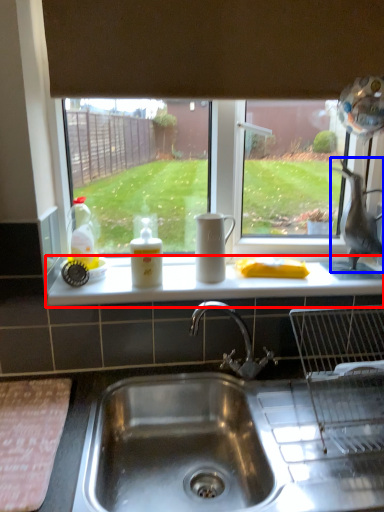
Question: Which object appears farthest to the camera in this image, counter top (highlighted by a red box) or animal (highlighted by a blue box)?

Choices:
 (A) counter top
 (B) animal

Answer: (B)